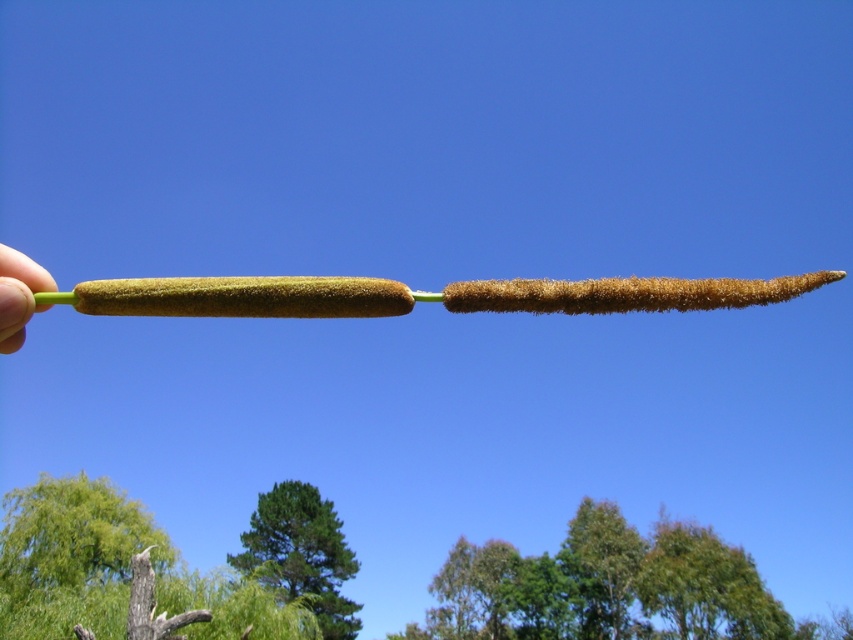
Locate an element on the screen. The width and height of the screenshot is (853, 640). green fuzzy tree at center is located at coordinates (300, 554).

Who is lower down, green fuzzy tree at center or green flesh at left?

Positioned lower is green fuzzy tree at center.

Is point (294, 568) less distant than point (9, 269)?

No, (294, 568) is behind (9, 269).

The width and height of the screenshot is (853, 640). Identify the location of green fuzzy tree at center. (300, 554).

Is green leafy tree at upper center further to camera compared to green fuzzy tree at center?

Yes, it is.

Is green leafy tree at upper center shorter than green fuzzy tree at center?

Incorrect, green leafy tree at upper center's height does not fall short of green fuzzy tree at center's.

Locate an element on the screen. The height and width of the screenshot is (640, 853). green leafy tree at upper center is located at coordinates (611, 588).

Based on the photo, can you confirm if green leafy tree at upper center is bigger than green flesh at left?

Correct, green leafy tree at upper center is larger in size than green flesh at left.

Who is positioned more to the right, green leafy tree at upper center or green flesh at left?

green leafy tree at upper center is more to the right.

What do you see at coordinates (611, 588) in the screenshot?
I see `green leafy tree at upper center` at bounding box center [611, 588].

The height and width of the screenshot is (640, 853). I want to click on green leafy tree at upper center, so click(611, 588).